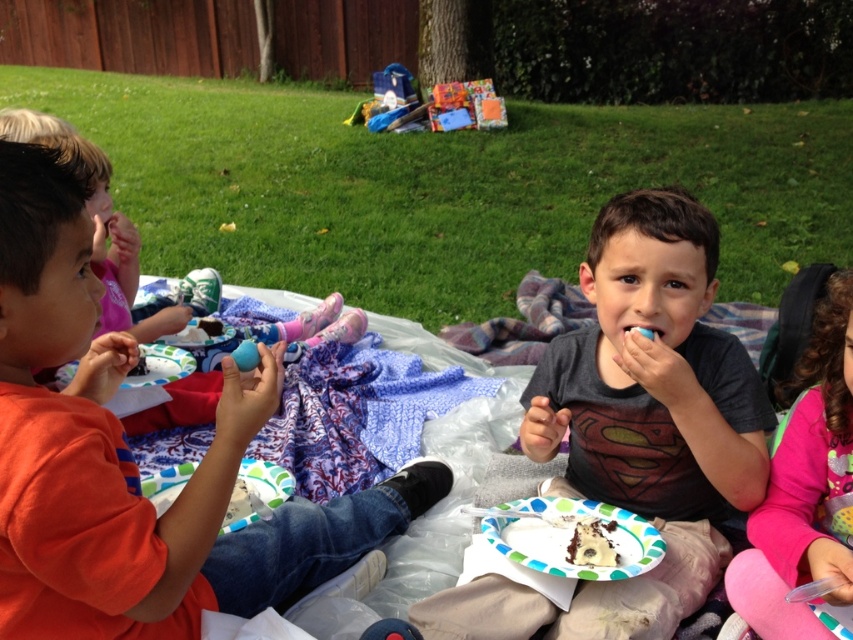
What do you see at coordinates (132, 460) in the screenshot?
I see `orange cotton shirt at left` at bounding box center [132, 460].

Which is more to the left, orange cotton shirt at left or pink fleece sweater at lower right?

Positioned to the left is orange cotton shirt at left.

The image size is (853, 640). I want to click on orange cotton shirt at left, so click(132, 460).

In the scene shown: Does green grass at center have a larger size compared to pink fleece sweater at lower right?

Yes, green grass at center is bigger than pink fleece sweater at lower right.

Between point (253, 218) and point (851, 435), which one is positioned behind?

The point (253, 218) is more distant.

This screenshot has height=640, width=853. Find the location of `green grass at center`. green grass at center is located at coordinates (440, 188).

Does orange cotton shirt at left have a smaller size compared to dark gray t-shirt at center?

Actually, orange cotton shirt at left might be larger than dark gray t-shirt at center.

From the picture: Is orange cotton shirt at left positioned behind dark gray t-shirt at center?

No, it is not.

Between point (1, 262) and point (450, 624), which one is positioned in front?

Point (1, 262) is in front.

Where is `orange cotton shirt at left`? orange cotton shirt at left is located at coordinates (132, 460).